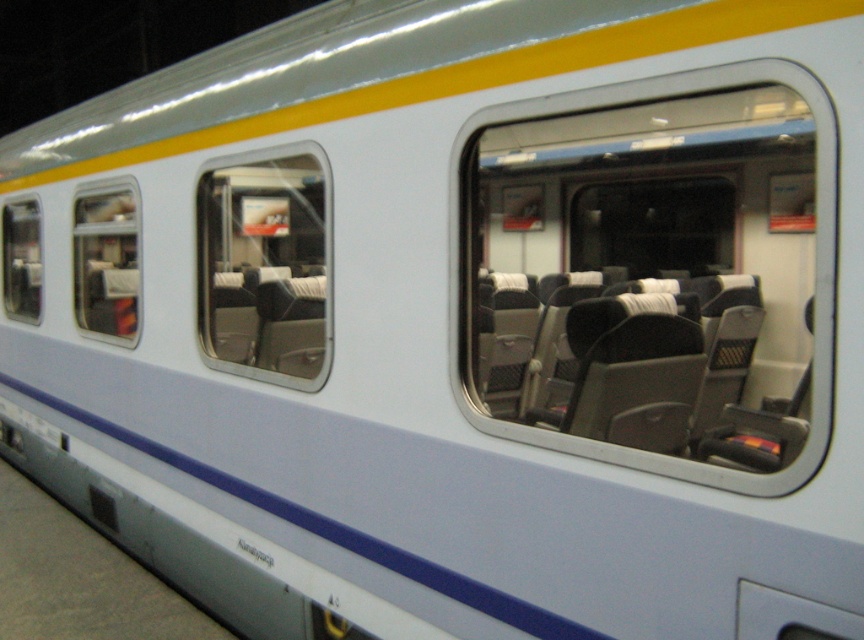
Question: Which of the following is the closest to the observer?

Choices:
 (A) (110, 273)
 (B) (224, 180)
 (C) (5, 205)

Answer: (B)

Question: Can you confirm if clear glass window at center is positioned to the right of clear glass window at left?

Choices:
 (A) yes
 (B) no

Answer: (A)

Question: Which point is farther to the camera?

Choices:
 (A) (297, 289)
 (B) (818, 96)
 (C) (121, 234)
 (D) (8, 298)

Answer: (D)

Question: In this image, where is transparent glass window at center located relative to transparent glass window at left?

Choices:
 (A) left
 (B) right

Answer: (B)

Question: Estimate the real-world distances between objects in this image. Which object is closer to the transparent glass window at center?

Choices:
 (A) clear glass window at left
 (B) clear glass window at center

Answer: (A)

Question: Does clear glass window at center lie behind transparent glass window at center?

Choices:
 (A) yes
 (B) no

Answer: (A)